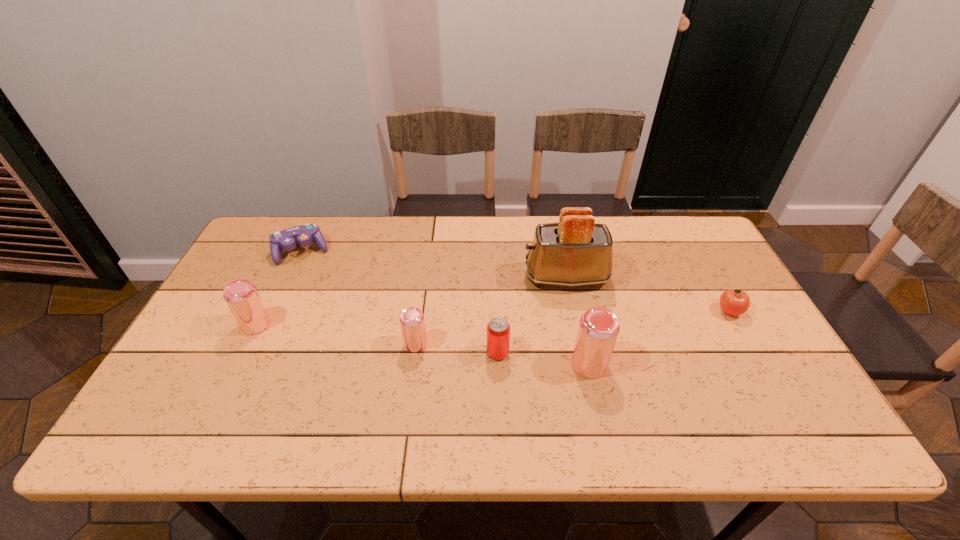
Where is `object present at the far edge`? The height and width of the screenshot is (540, 960). object present at the far edge is located at coordinates (287, 239).

The height and width of the screenshot is (540, 960). Identify the location of object that is positioned at the near edge. tap(598, 329).

This screenshot has width=960, height=540. Find the location of `beer can located at the left edge`. beer can located at the left edge is located at coordinates (241, 296).

This screenshot has width=960, height=540. I want to click on control present at the left edge, so click(x=287, y=239).

You are a GUI agent. You are given a task and a screenshot of the screen. Output one action in this format:
    pyautogui.click(x=<x>, y=<y>)
    Task: Click on the object positioned at the right edge
    
    Given the screenshot: What is the action you would take?
    pyautogui.click(x=734, y=302)

The height and width of the screenshot is (540, 960). Find the location of `object that is at the far left corner`. object that is at the far left corner is located at coordinates (287, 239).

Locate an element on the screen. The image size is (960, 540). free location at the far edge is located at coordinates (644, 247).

Identify the location of vacant area at the left edge of the desktop. The image size is (960, 540). (228, 349).

At what (x,y) coordinates should I click in order to perform the action: click on vacant space at the right edge of the desktop. Please return your answer as a coordinate pair (x, y). This screenshot has width=960, height=540. Looking at the image, I should click on (753, 311).

The height and width of the screenshot is (540, 960). I want to click on vacant space at the far left corner of the desktop, so click(x=273, y=217).